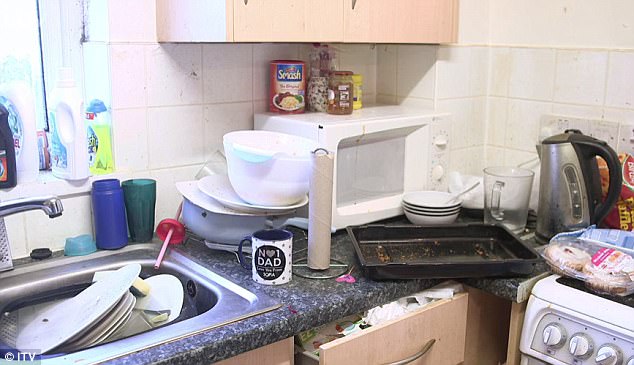
Locate an element on the screen. The width and height of the screenshot is (634, 365). faucet is located at coordinates (54, 206).